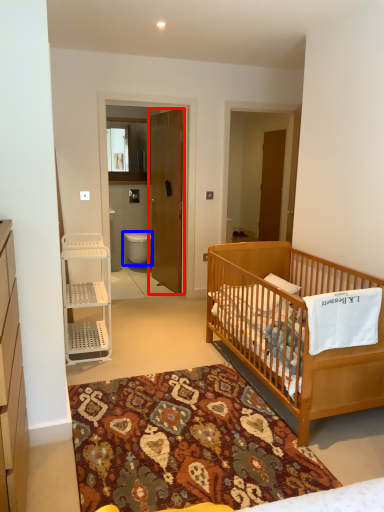
Question: Which of the following is the closest to the observer, door (highlighted by a red box) or toilet (highlighted by a blue box)?

Choices:
 (A) door
 (B) toilet

Answer: (A)